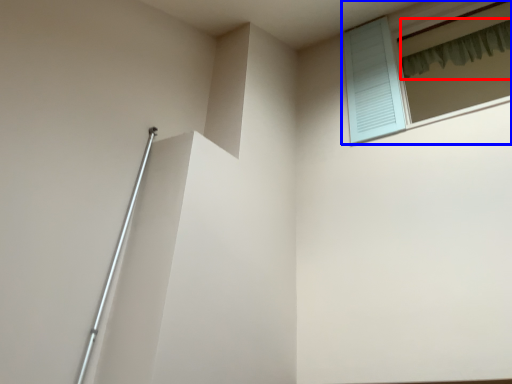
Question: Which point is further to the camera, shower curtain (highlighted by a red box) or window (highlighted by a blue box)?

Choices:
 (A) shower curtain
 (B) window

Answer: (A)